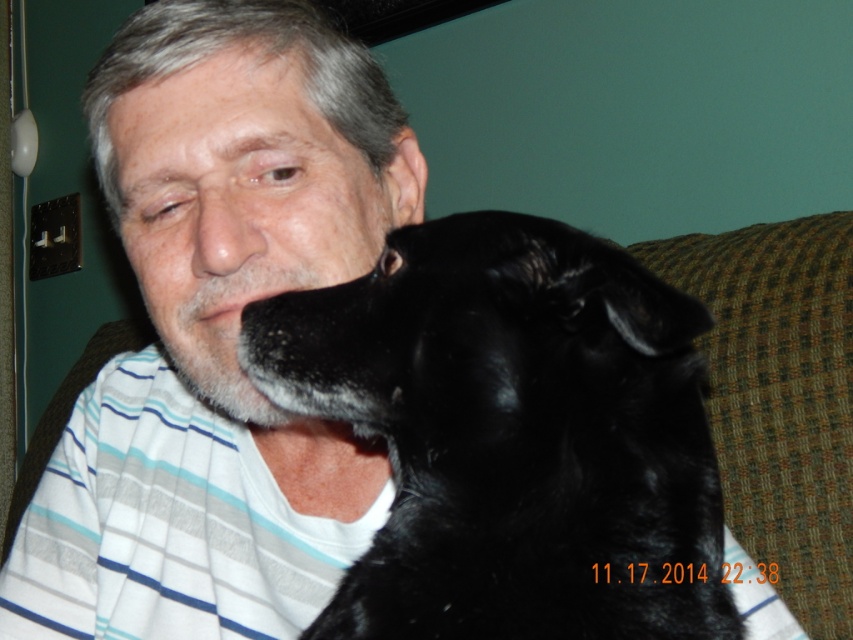
Is black fur dog at left closer to the viewer compared to matte black face at center?

Yes, it is.

Is point (373, 541) closer to camera compared to point (312, 260)?

Yes, point (373, 541) is closer to viewer.

Does point (569, 625) come behind point (152, 173)?

No, it is in front of (152, 173).

The height and width of the screenshot is (640, 853). I want to click on black fur dog at left, so click(514, 435).